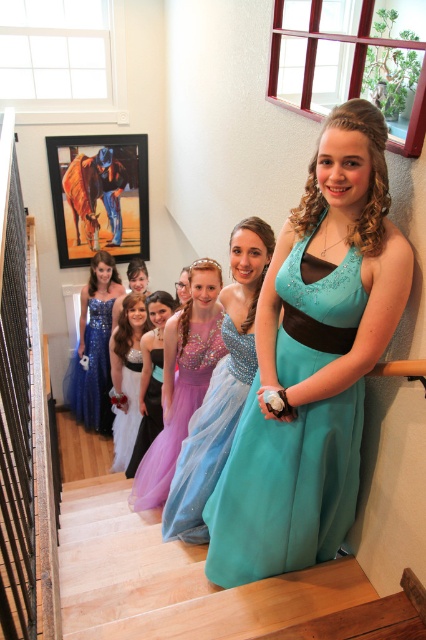
You are a photographer at a prom event. You need to arrange the two dresses, teal satin dress at center and shiny blue dress at left, side by side for a photo. Which dress should you place on the left side to make the arrangement look balanced?

The teal satin dress at center is thinner than the shiny blue dress at left. To balance the arrangement, place the wider shiny blue dress at left on the left side and the thinner teal satin dress at center on the right side.

You are a photographer taking a group photo of the women on the staircase. You notice the purple tulle dress at center and the white satin dress at center. Which dress is positioned to the right of the other?

The purple tulle dress at center is to the right of the white satin dress at center.